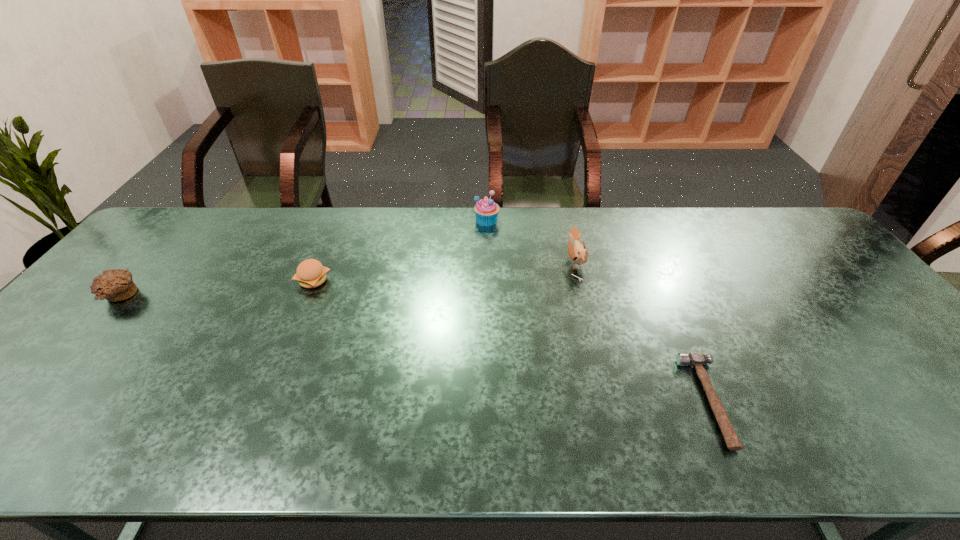
Locate an element on the screen. free space between the hamburger and the hammer is located at coordinates (512, 341).

Where is `free space between the fourth object from right to left and the left muffin`? The image size is (960, 540). free space between the fourth object from right to left and the left muffin is located at coordinates (216, 288).

The height and width of the screenshot is (540, 960). Find the location of `free spot between the farther muffin and the bird`. free spot between the farther muffin and the bird is located at coordinates (531, 241).

Identify the location of free spot between the second object from left to right and the nearest object. (512, 341).

Find the location of `vacant space that's between the nearer muffin and the farthest object`. vacant space that's between the nearer muffin and the farthest object is located at coordinates pyautogui.click(x=303, y=258).

Where is `the third closest object to the fourth object from left to right`? This screenshot has height=540, width=960. the third closest object to the fourth object from left to right is located at coordinates (310, 273).

The height and width of the screenshot is (540, 960). Identify the location of the third closest object to the hamburger. (578, 253).

Where is `free space that satisfies the following two spatial constraints: 1. on the back side of the farther muffin; 2. on the left side of the second object from left to right`? free space that satisfies the following two spatial constraints: 1. on the back side of the farther muffin; 2. on the left side of the second object from left to right is located at coordinates (339, 220).

Where is `vacant space that satisfies the following two spatial constraints: 1. at the beak of the bird; 2. on the front side of the second object from left to right`? This screenshot has height=540, width=960. vacant space that satisfies the following two spatial constraints: 1. at the beak of the bird; 2. on the front side of the second object from left to right is located at coordinates (580, 281).

Locate an element on the screen. This screenshot has width=960, height=540. vacant area in the image that satisfies the following two spatial constraints: 1. at the beak of the bird; 2. on the front side of the shorter muffin is located at coordinates (584, 296).